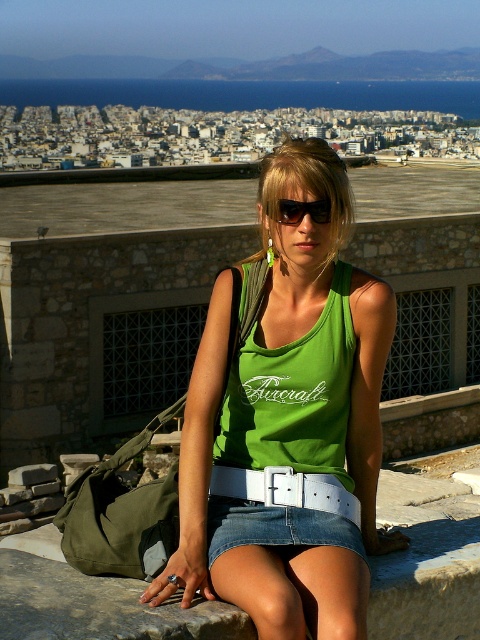
Image resolution: width=480 pixels, height=640 pixels. Describe the element at coordinates (292, 396) in the screenshot. I see `green fabric vest at center` at that location.

Where is `green fabric vest at center`? This screenshot has width=480, height=640. green fabric vest at center is located at coordinates (292, 396).

Identify the location of green fabric vest at center. (292, 396).

Can you confirm if green fabric tank top at center is positioned to the right of black plastic sunglasses at center?

No, green fabric tank top at center is not to the right of black plastic sunglasses at center.

Is point (292, 358) in front of point (295, 212)?

No, (292, 358) is further to viewer.

You are a GUI agent. You are given a task and a screenshot of the screen. Output one action in this format:
    pyautogui.click(x=<x>, y=<y>)
    Task: Click on the green fabric tank top at center
    This screenshot has height=640, width=480.
    Given the screenshot: What is the action you would take?
    pyautogui.click(x=288, y=424)

Who is higher up, white leather belt at center or black plastic sunglasses at center?

Positioned higher is black plastic sunglasses at center.

The width and height of the screenshot is (480, 640). In order to click on white leather belt at center in this screenshot , I will do tap(286, 490).